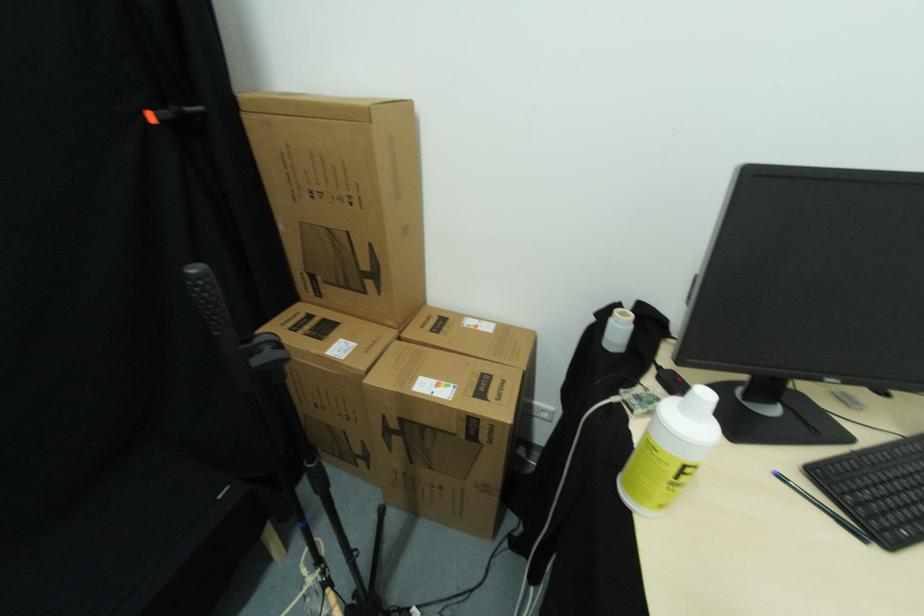
In order to click on blue and black pen in this screenshot , I will do `click(823, 508)`.